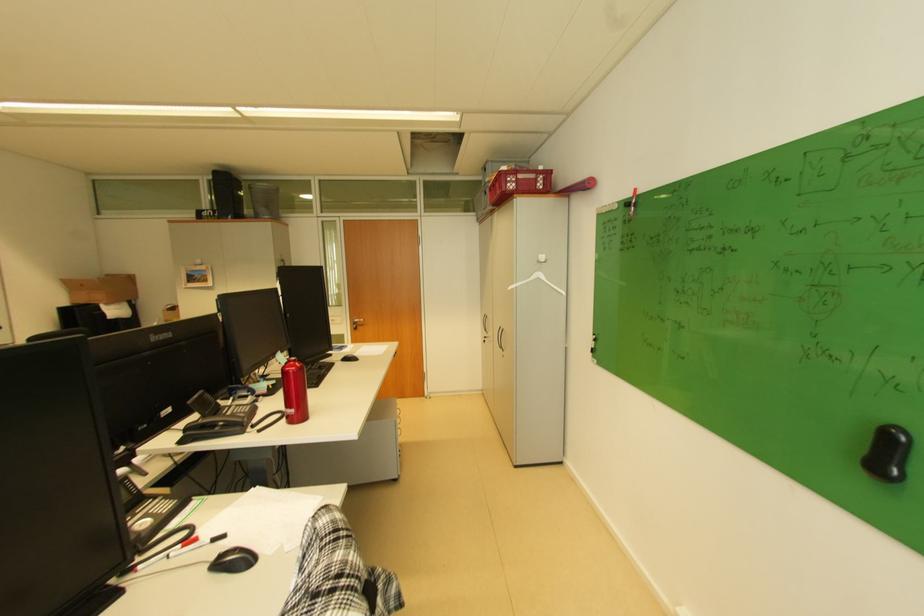
The width and height of the screenshot is (924, 616). Identify the location of white clothes hanger. (538, 282).